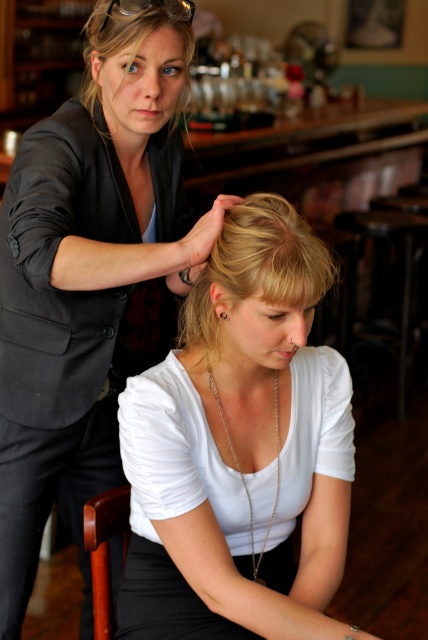
You are standing in the bar and want to place a small decoration between the two points labeled point (288, 260) and point (178, 33). Which point should the decoration be closer to in order to appear centered from your viewpoint?

The decoration should be closer to point (178, 33) because point (288, 260) is closer to the viewer. To appear centered, the decoration needs to compensate by being nearer to the farther point.

You are a customer in this bar and want to know which object is closer to the ceiling. Based on the scene, which one is shorter between the blonde hair at upper left and the silver chain necklace at center?

The blonde hair at upper left is shorter than the silver chain necklace at center, so the silver chain necklace at center is closer to the ceiling.